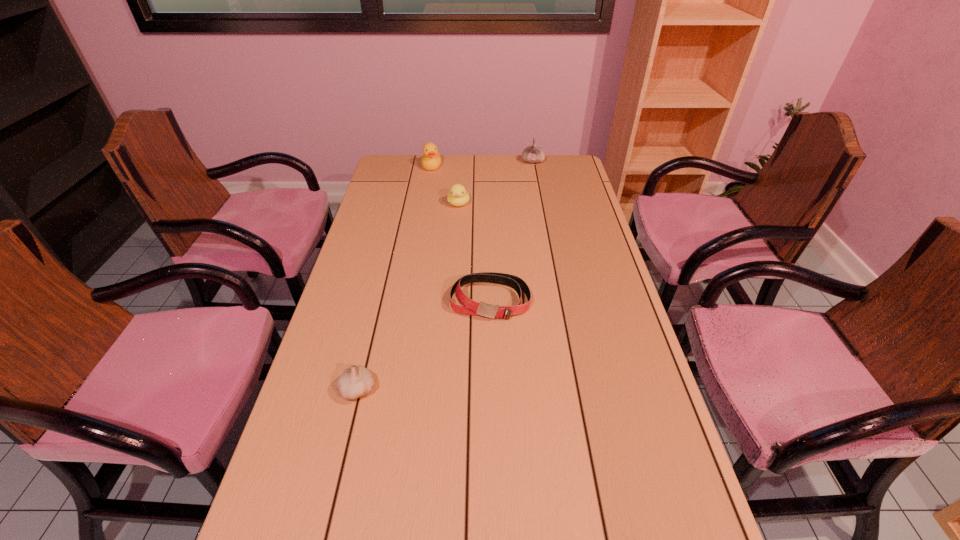
Where is `object identified as the closest to the left garlic`? This screenshot has height=540, width=960. object identified as the closest to the left garlic is located at coordinates (468, 306).

At what (x,y) coordinates should I click in order to perform the action: click on object that stands as the second closest to the nearest object. Please return your answer as a coordinate pair (x, y). The image size is (960, 540). Looking at the image, I should click on (457, 196).

Where is `free location that satisfies the following two spatial constraints: 1. at the beak of the second nearest object; 2. on the right side of the third nearest object`? free location that satisfies the following two spatial constraints: 1. at the beak of the second nearest object; 2. on the right side of the third nearest object is located at coordinates (452, 301).

Locate an element on the screen. This screenshot has height=540, width=960. blank area in the image that satisfies the following two spatial constraints: 1. at the beak of the dog collar; 2. on the left side of the third farthest object is located at coordinates (452, 301).